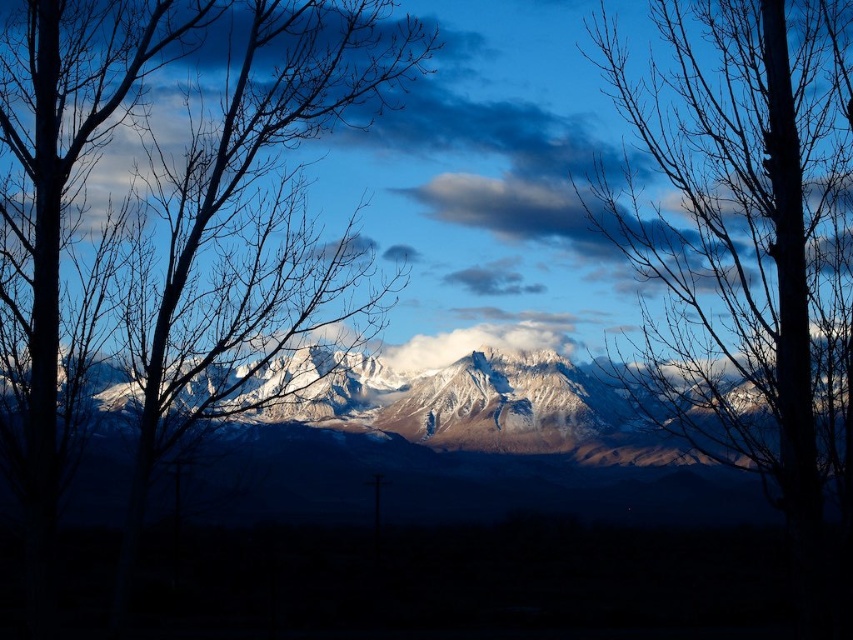
You are an artist trying to paint the mountain landscape. You notice two sets of branches in the foreground. Which of the two, the bare branches at center or the silhouette bare branches at left, would you depict as thinner in your painting?

The bare branches at center is thinner than the silhouette bare branches at left, so you should depict the bare branches at center as thinner in your painting.

You are standing in the mountain landscape and want to take a photo of the snowcapped peaks. There is a bare branches at center in your way. Where should you move to avoid it?

The bare branches at center are located at point (x=744, y=230). To avoid them, move either to the left or right of that position to frame the snowcapped peaks without obstruction.

From the picture: You are an observer standing in the mountain landscape. You notice the silhouette bare branches at left and the snowy rock mountain range at center. Which object appears taller from your viewpoint?

The silhouette bare branches at left appears taller than the snowy rock mountain range at center from your viewpoint because they are closer to you, making them appear larger in comparison.